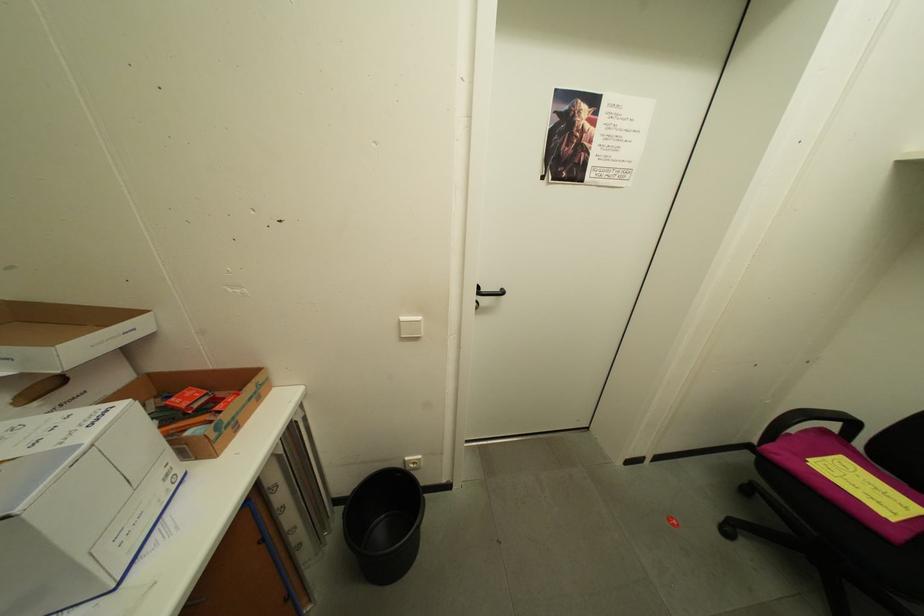
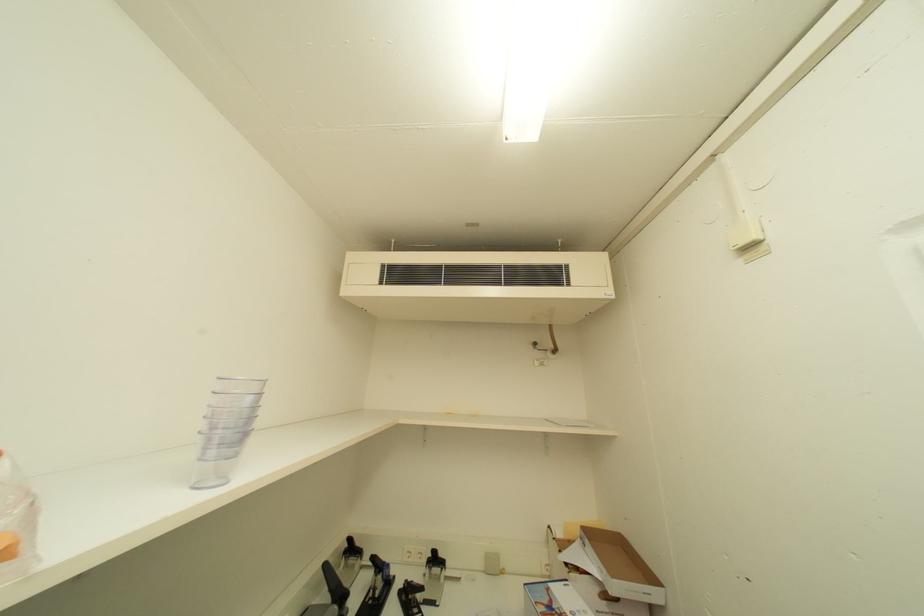
Question: The first image is from the beginning of the video and the second image is from the end. How did the camera likely rotate when shooting the video?

Choices:
 (A) Left
 (B) Right
 (C) Up
 (D) Down

Answer: (A)